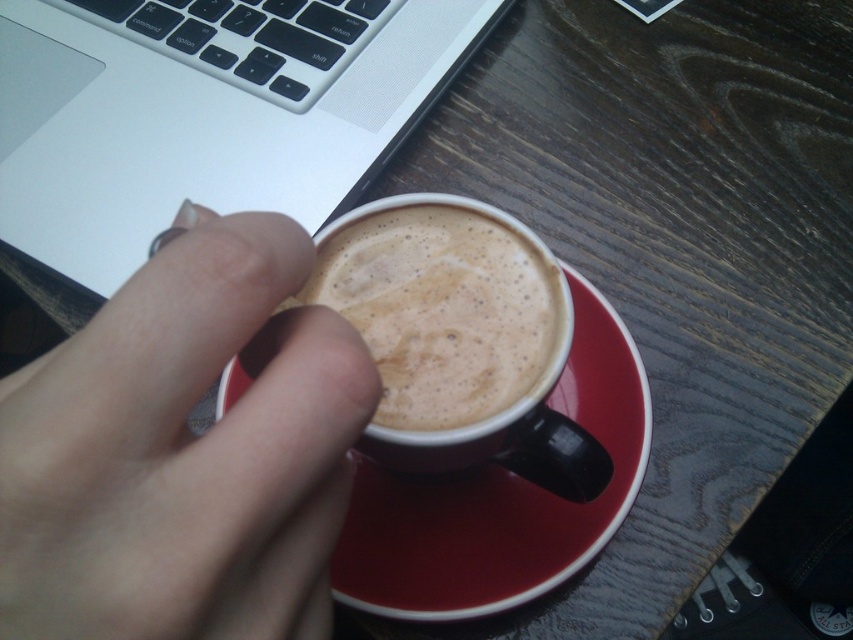
You are a barista trying to place a new coffee cup on the table without blocking the keyboard of the silver metallic laptop at upper left. Considering the size of the smooth skin hand at upper center holding the cup, will the cup fit in the space between the hand and the laptop?

The smooth skin hand at upper center is not as tall as the silver metallic laptop at upper left, so there is enough space between them to place the cup without blocking the keyboard.

In the scene shown: You are a barista trying to place a small sugar cube on the table between the two points, point (334,330) and point (521,356). Which point should you place it closer to so that the sugar cube is closer to the viewer?

You should place the sugar cube closer to point (334,330) because it is closer to the viewer than point (521,356).